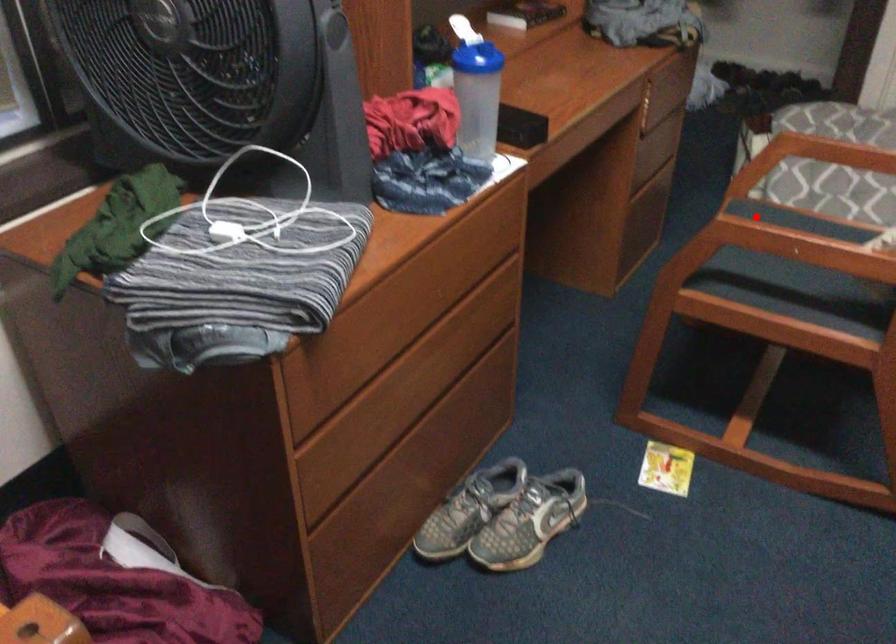
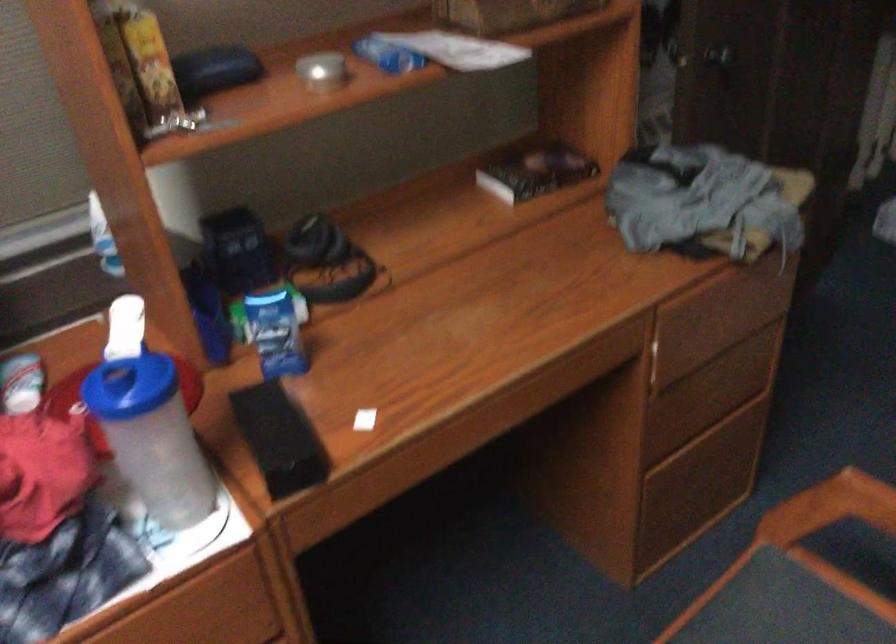
Question: I am providing you with two images of the same scene from different viewpoints. In image1, a red point is highlighted. Considering the same 3D point in image2, which of the following is correct?

Choices:
 (A) It is closer
 (B) It is farther

Answer: (A)